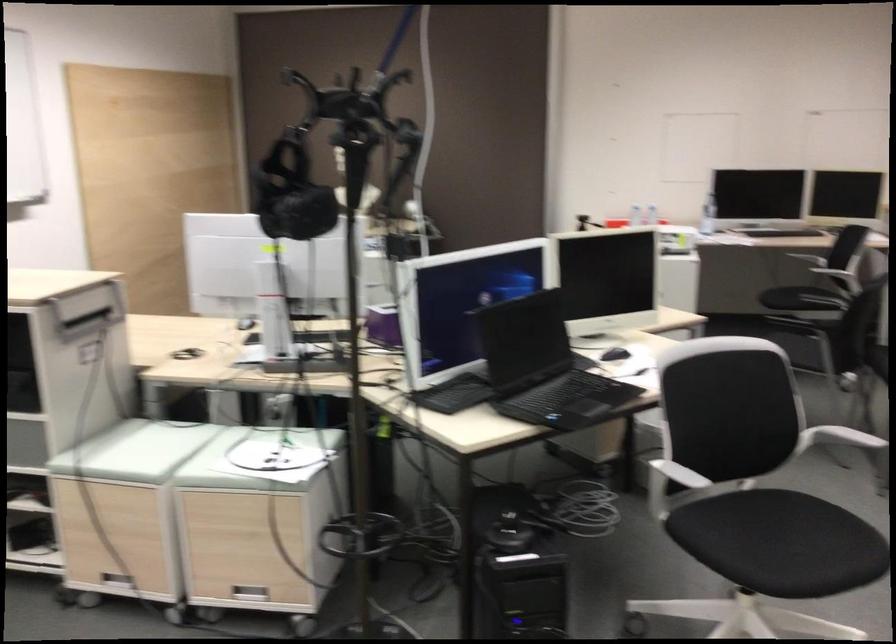
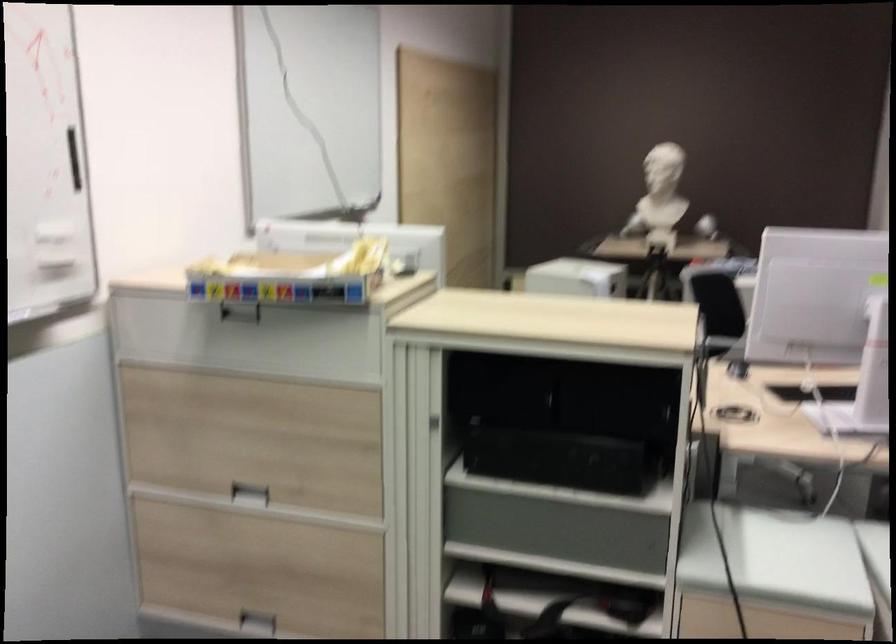
What movement of the cameraman would produce the second image?

The cameraman moved toward left, forward.